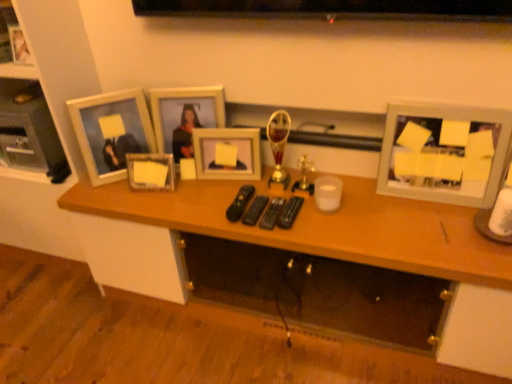
Where is `vacant space in front of black plastic remote control at center, which appears as the 2th remote control when viewed from the left`? The width and height of the screenshot is (512, 384). vacant space in front of black plastic remote control at center, which appears as the 2th remote control when viewed from the left is located at coordinates (269, 231).